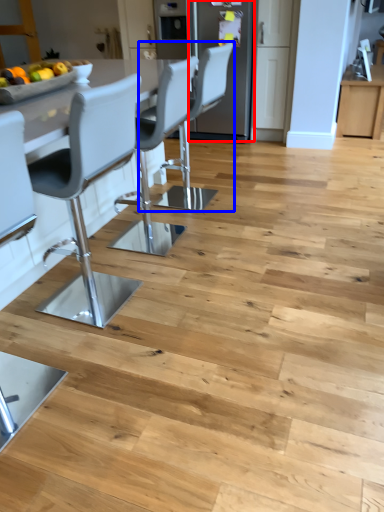
Question: Which of the following is the farthest to the observer, appliance (highlighted by a red box) or chair (highlighted by a blue box)?

Choices:
 (A) appliance
 (B) chair

Answer: (A)